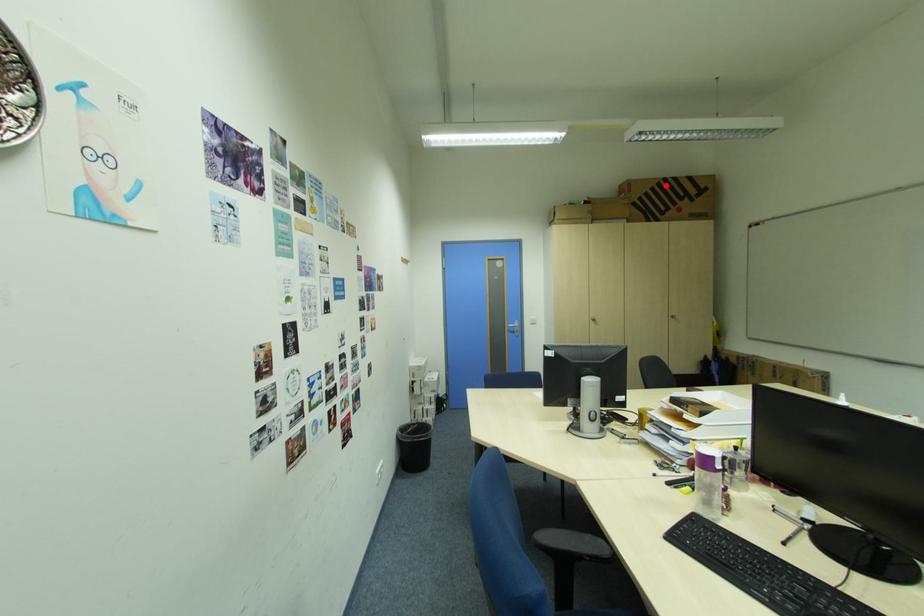
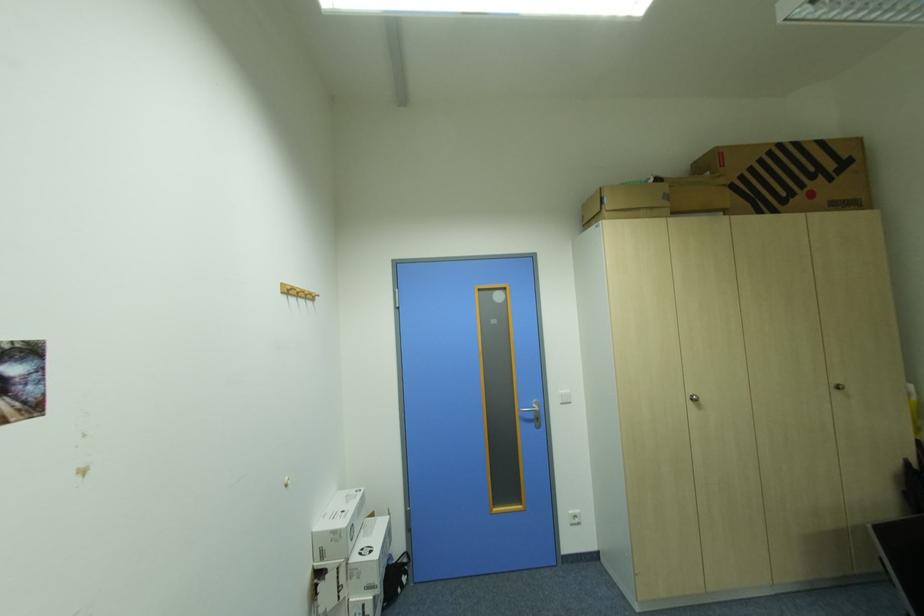
The point at the highlighted location is marked in the first image. Where is the corresponding point in the second image?

(777, 153)